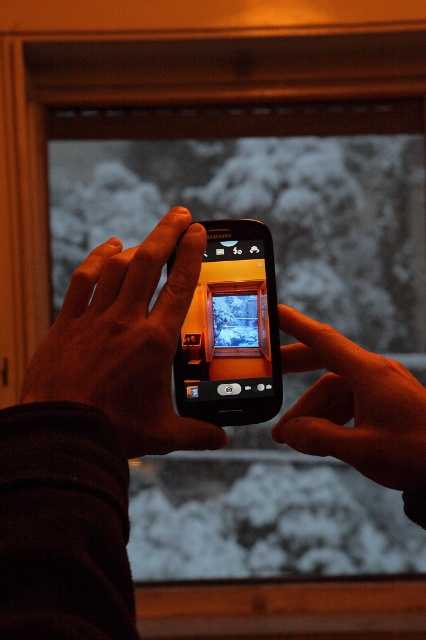
Question: Which object is the farthest from the orange matte hand at center?

Choices:
 (A) black glossy phone at center
 (B) black matte phone at center

Answer: (B)

Question: Can you confirm if orange matte hand at center is bigger than black glossy phone at center?

Choices:
 (A) no
 (B) yes

Answer: (B)

Question: Which of the following is the closest to the observer?

Choices:
 (A) (353, 403)
 (B) (178, 403)
 (C) (101, 264)

Answer: (C)

Question: Considering the relative positions of black matte phone at center and black glossy phone at center in the image provided, where is black matte phone at center located with respect to black glossy phone at center?

Choices:
 (A) right
 (B) left

Answer: (B)

Question: Does orange matte hand at center have a larger size compared to black glossy phone at center?

Choices:
 (A) yes
 (B) no

Answer: (A)

Question: Which of the following is the closest to the observer?

Choices:
 (A) black glossy phone at center
 (B) black matte phone at center
 (C) orange matte hand at center

Answer: (B)